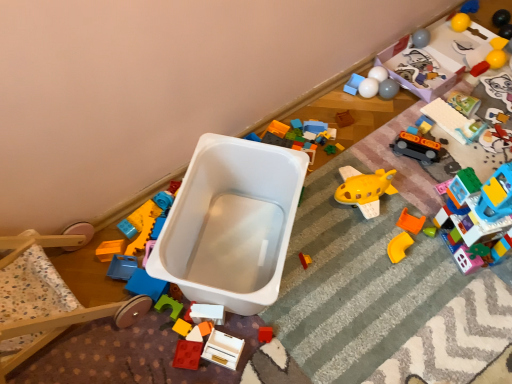
Image resolution: width=512 pixels, height=384 pixels. In order to click on vacant space behind rubberized red brick at lower center, the 2th toy viewed from the left in this screenshot , I will do `click(197, 283)`.